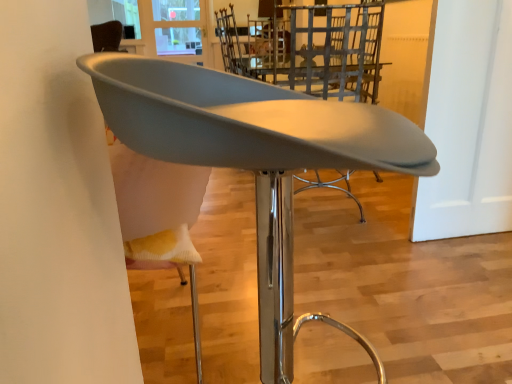
Question: Is point (192, 29) positioned closer to the camera than point (359, 99)?

Choices:
 (A) closer
 (B) farther

Answer: (B)

Question: Would you say transparent glass window at upper center is inside or outside metallic silver chair at center, which ranks as the 1th chair in back-to-front order?

Choices:
 (A) inside
 (B) outside

Answer: (B)

Question: Based on their relative distances, which object is nearer to the metallic silver chair at center, which appears as the second chair when viewed from the front?

Choices:
 (A) matte gray chair at center, positioned as the second chair in back-to-front order
 (B) transparent glass window at upper center

Answer: (A)

Question: Which of these objects is positioned closest to the metallic silver chair at center, which ranks as the 1th chair in back-to-front order?

Choices:
 (A) transparent glass window at upper center
 (B) matte gray chair at center, positioned as the second chair in back-to-front order

Answer: (B)